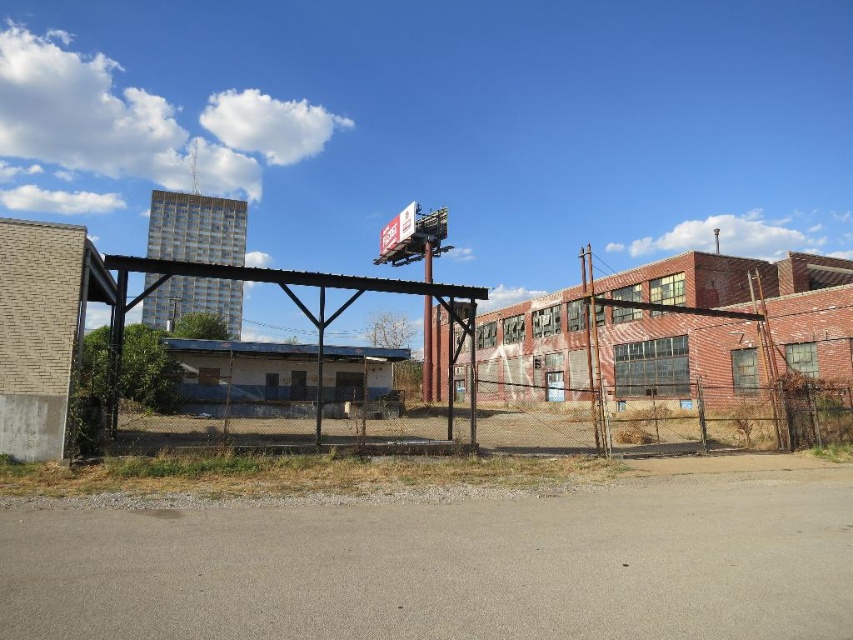
The image size is (853, 640). I want to click on rusty metal fence at center, so click(x=740, y=419).

Is rusty metal fence at center further to camera compared to white plastic billboard at upper center?

No.

Between point (460, 406) and point (387, 230), which one is positioned behind?

The point (387, 230) is more distant.

Locate an element on the screen. The width and height of the screenshot is (853, 640). rusty metal fence at center is located at coordinates (740, 419).